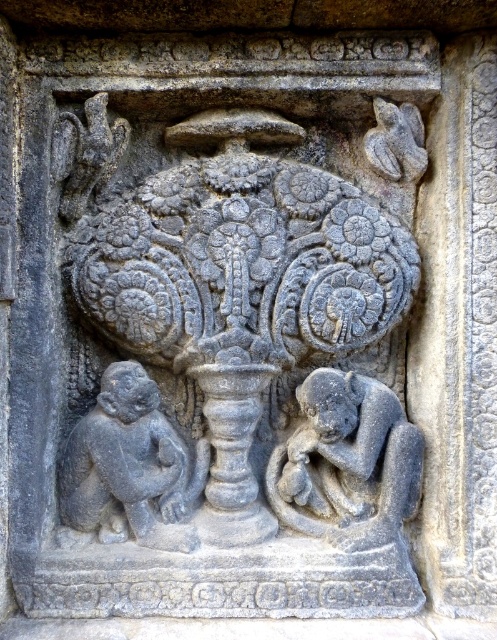
Question: Among these points, which one is nearest to the camera?

Choices:
 (A) (337, 538)
 (B) (226, 205)
 (C) (138, 436)

Answer: (B)

Question: Estimate the real-world distances between objects in this image. Which object is closer to the gray stone monkey at lower left?

Choices:
 (A) gray stone monkey at lower right
 (B) gray stone vase at center

Answer: (B)

Question: Is gray stone vase at center further to camera compared to gray stone monkey at lower left?

Choices:
 (A) no
 (B) yes

Answer: (B)

Question: Is gray stone vase at center thinner than gray stone monkey at lower left?

Choices:
 (A) yes
 (B) no

Answer: (B)

Question: Which object is farther from the camera taking this photo?

Choices:
 (A) gray stone monkey at lower left
 (B) gray stone monkey at lower right

Answer: (B)

Question: Considering the relative positions of gray stone vase at center and gray stone monkey at lower right in the image provided, where is gray stone vase at center located with respect to gray stone monkey at lower right?

Choices:
 (A) above
 (B) below

Answer: (A)